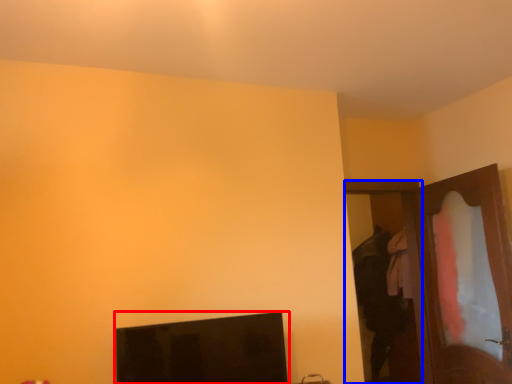
Question: Which point is further to the camera, computer monitor (highlighted by a red box) or door (highlighted by a blue box)?

Choices:
 (A) computer monitor
 (B) door

Answer: (B)